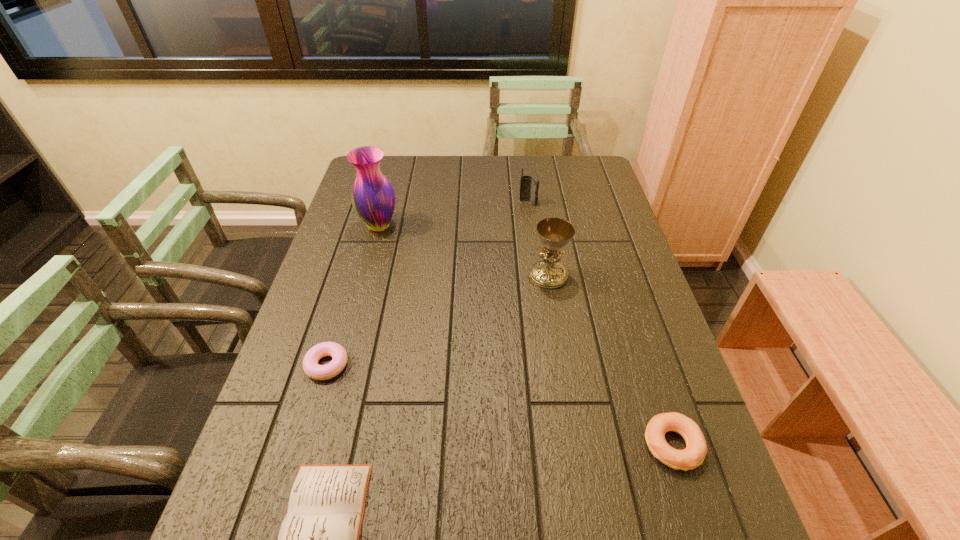
Choose which object is the fourth nearest neighbor to the vase. Please provide its 2D coordinates. Your answer should be formatted as a tuple, i.e. [(x, y)], where the tuple contains the x and y coordinates of a point satisfying the conditions above.

[(319, 538)]

Image resolution: width=960 pixels, height=540 pixels. In order to click on vacant region that satisfies the following two spatial constraints: 1. on the keyboard of the cellular telephone; 2. on the left side of the bagel in this screenshot , I will do `click(562, 446)`.

You are a GUI agent. You are given a task and a screenshot of the screen. Output one action in this format:
    pyautogui.click(x=<x>, y=<y>)
    Task: Click on the vacant space that satisfies the following two spatial constraints: 1. on the keyboard of the bagel; 2. on the right side of the cellular telephone
    Image resolution: width=960 pixels, height=540 pixels.
    Given the screenshot: What is the action you would take?
    pyautogui.click(x=562, y=446)

Where is `vacant position in the image that satisfies the following two spatial constraints: 1. on the keyboard of the fourth shortest object; 2. on the left side of the rightmost object`? The image size is (960, 540). vacant position in the image that satisfies the following two spatial constraints: 1. on the keyboard of the fourth shortest object; 2. on the left side of the rightmost object is located at coordinates (562, 446).